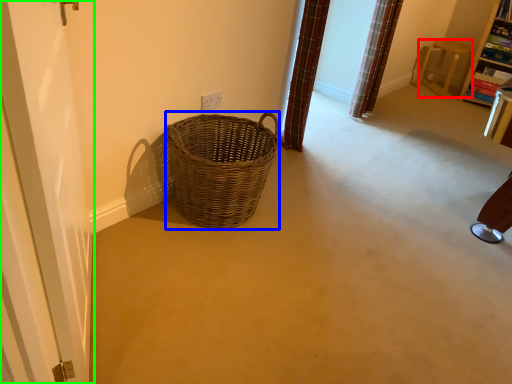
Question: Based on their relative distances, which object is nearer to furniture (highlighted by a red box)? Choose from basket (highlighted by a blue box) and screen door (highlighted by a green box).

Choices:
 (A) basket
 (B) screen door

Answer: (A)